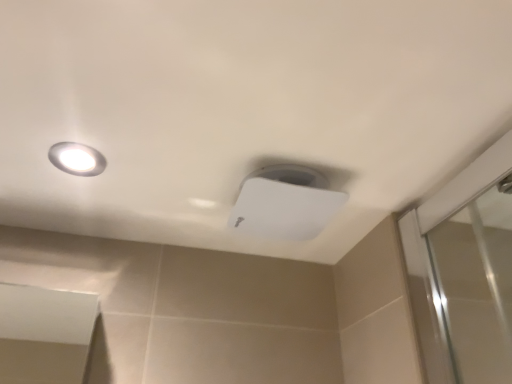
The height and width of the screenshot is (384, 512). What do you see at coordinates (285, 203) in the screenshot?
I see `white plastic lamp at upper center` at bounding box center [285, 203].

What is the approximate width of white plastic lamp at upper center?

It is 19.09 centimeters.

Locate an element on the screen. white plastic lamp at upper center is located at coordinates (285, 203).

Where is `matte white droplight at upper left`? This screenshot has height=384, width=512. matte white droplight at upper left is located at coordinates (77, 159).

This screenshot has height=384, width=512. Describe the element at coordinates (77, 159) in the screenshot. I see `matte white droplight at upper left` at that location.

Locate an element on the screen. The height and width of the screenshot is (384, 512). white plastic lamp at upper center is located at coordinates (285, 203).

Which is more to the right, white plastic lamp at upper center or matte white droplight at upper left?

From the viewer's perspective, white plastic lamp at upper center appears more on the right side.

Which object is closer to the camera, white plastic lamp at upper center or matte white droplight at upper left?

matte white droplight at upper left is in front.

Considering the positions of point (259, 192) and point (84, 167), is point (259, 192) closer or farther from the camera than point (84, 167)?

Point (259, 192) appears to be closer to the viewer than point (84, 167).

From the image's perspective, is white plastic lamp at upper center located beneath matte white droplight at upper left?

Yes, from the image's perspective, white plastic lamp at upper center is beneath matte white droplight at upper left.

From the picture: From a real-world perspective, is white plastic lamp at upper center located higher than matte white droplight at upper left?

No.

Does white plastic lamp at upper center have a lesser width compared to matte white droplight at upper left?

No.

In terms of height, does white plastic lamp at upper center look taller or shorter compared to matte white droplight at upper left?

white plastic lamp at upper center is taller than matte white droplight at upper left.

Between white plastic lamp at upper center and matte white droplight at upper left, which one has larger size?

white plastic lamp at upper center is bigger.

Is white plastic lamp at upper center surrounding matte white droplight at upper left?

No, white plastic lamp at upper center does not contain matte white droplight at upper left.

Are white plastic lamp at upper center and matte white droplight at upper left far apart?

They are positioned close to each other.

Is white plastic lamp at upper center oriented towards matte white droplight at upper left?

No, white plastic lamp at upper center is not turned towards matte white droplight at upper left.

What's the angular difference between white plastic lamp at upper center and matte white droplight at upper left's facing directions?

They differ by 1.56 degrees in their facing directions.

How much distance is there between white plastic lamp at upper center and matte white droplight at upper left?

12.32 inches.

Locate an element on the screen. lamp on the right of the matte white droplight at upper left is located at coordinates (285, 203).

Which object is positioned more to the left, matte white droplight at upper left or white plastic lamp at upper center?

Positioned to the left is matte white droplight at upper left.

Is matte white droplight at upper left closer to the viewer compared to white plastic lamp at upper center?

That is True.

Between point (83, 158) and point (312, 209), which one is positioned behind?

Positioned behind is point (312, 209).

From the image's perspective, does matte white droplight at upper left appear higher than white plastic lamp at upper center?

Yes, from the image's perspective, matte white droplight at upper left is on top of white plastic lamp at upper center.

From a real-world perspective, is matte white droplight at upper left beneath white plastic lamp at upper center?

Actually, matte white droplight at upper left is physically above white plastic lamp at upper center in the real world.

Which object is wider, matte white droplight at upper left or white plastic lamp at upper center?

white plastic lamp at upper center is wider.

Considering the relative sizes of matte white droplight at upper left and white plastic lamp at upper center in the image provided, is matte white droplight at upper left shorter than white plastic lamp at upper center?

Yes.

Is matte white droplight at upper left smaller than white plastic lamp at upper center?

Yes.

Is matte white droplight at upper left inside the boundaries of white plastic lamp at upper center, or outside?

matte white droplight at upper left exists outside the volume of white plastic lamp at upper center.

Is matte white droplight at upper left touching white plastic lamp at upper center?

No, matte white droplight at upper left is not in contact with white plastic lamp at upper center.

Could you tell me if matte white droplight at upper left is turned towards white plastic lamp at upper center?

No, matte white droplight at upper left does not turn towards white plastic lamp at upper center.

Where is `droplight lying in front of the white plastic lamp at upper center`? droplight lying in front of the white plastic lamp at upper center is located at coordinates click(x=77, y=159).

Identify the location of lamp located behind the matte white droplight at upper left. The width and height of the screenshot is (512, 384). [x=285, y=203].

This screenshot has height=384, width=512. In order to click on lamp below the matte white droplight at upper left (from a real-world perspective) in this screenshot , I will do `click(285, 203)`.